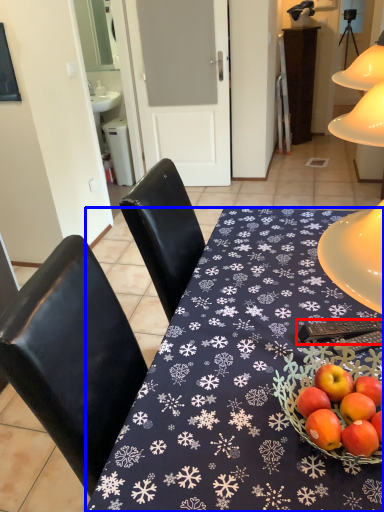
Question: Which object appears farthest to the camera in this image, remote control (highlighted by a red box) or desk (highlighted by a blue box)?

Choices:
 (A) remote control
 (B) desk

Answer: (A)